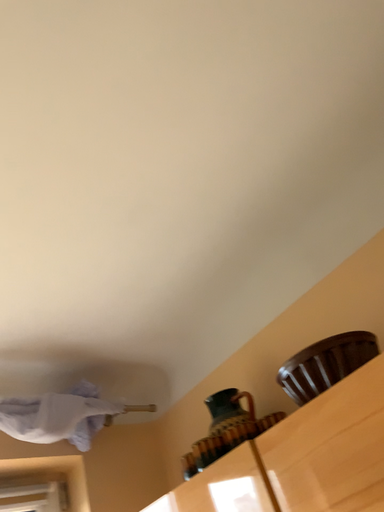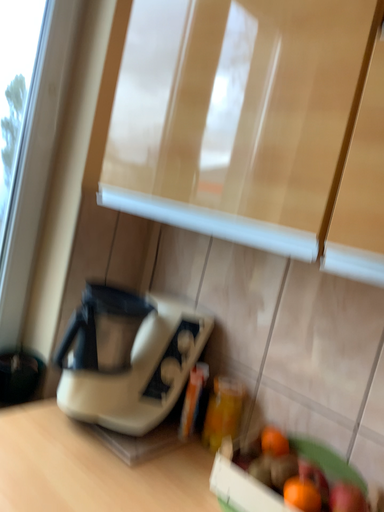
Question: How did the camera likely rotate when shooting the video?

Choices:
 (A) rotated upward
 (B) rotated downward

Answer: (B)